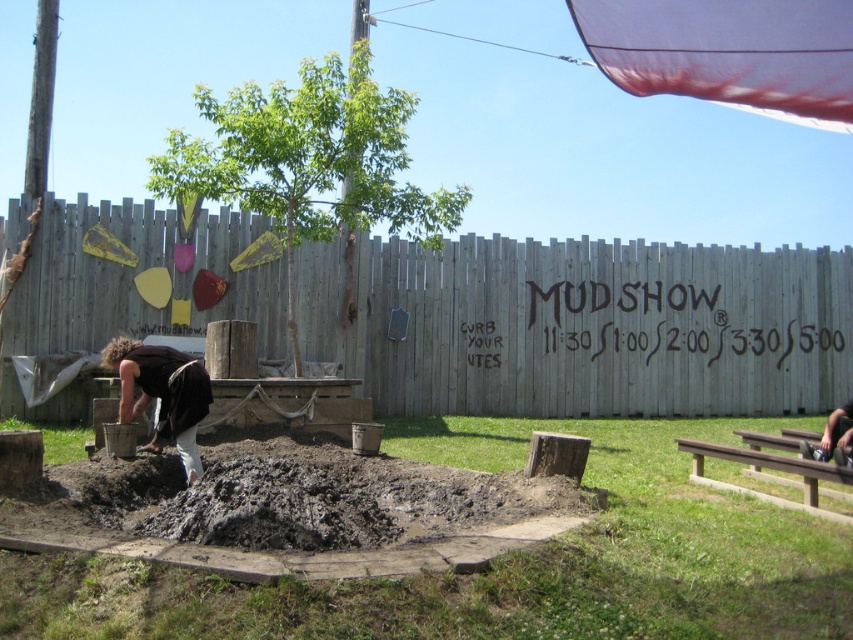
Question: Is brown mud pit at lower center bigger than dark brown wood at lower left?

Choices:
 (A) no
 (B) yes

Answer: (B)

Question: Is dark brown wood at lower left behind metallic silver squat at lower right?

Choices:
 (A) no
 (B) yes

Answer: (A)

Question: Based on their relative distances, which object is nearer to the dark brown wood at lower left?

Choices:
 (A) brown mud pit at lower center
 (B) metallic silver squat at lower right

Answer: (A)

Question: Which of the following is the closest to the observer?

Choices:
 (A) (402, 163)
 (B) (850, 436)
 (C) (755, 605)
 (D) (149, 356)

Answer: (C)

Question: Is brown mud pit at lower center to the right of green leafy tree at center from the viewer's perspective?

Choices:
 (A) no
 (B) yes

Answer: (B)

Question: Which of the following is the closest to the observer?

Choices:
 (A) pos(782,630)
 (B) pos(809,456)

Answer: (A)